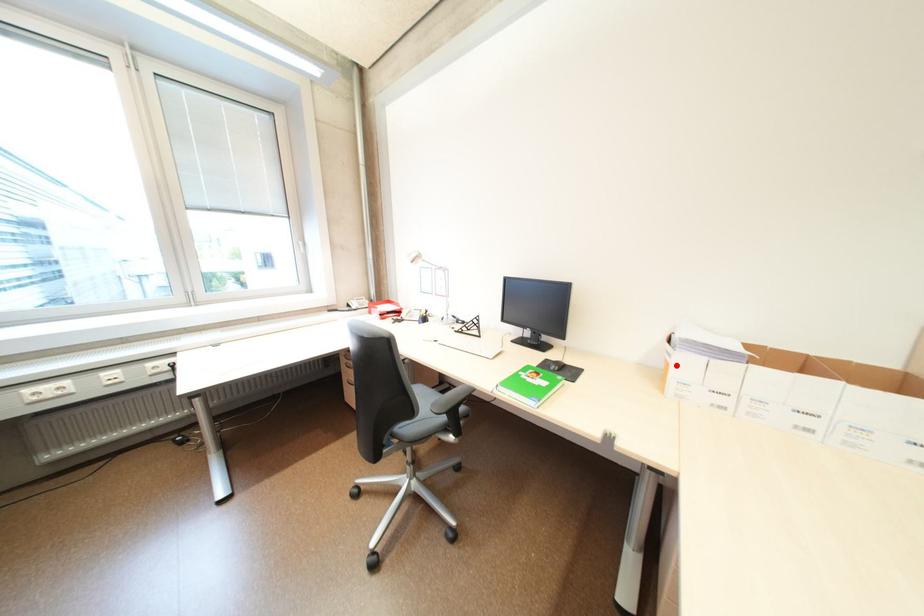
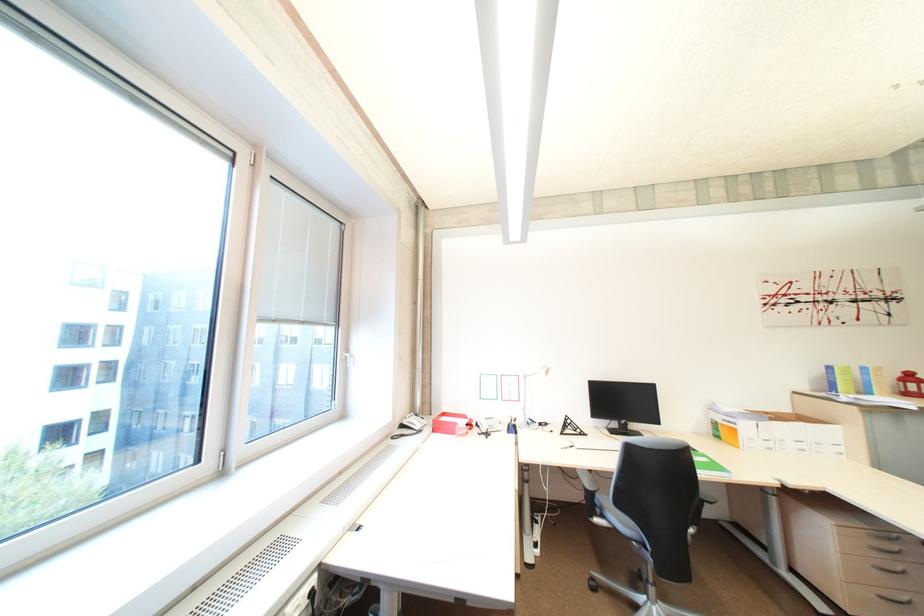
The point at the highlighted location is marked in the first image. Where is the corresponding point in the second image?

(745, 431)